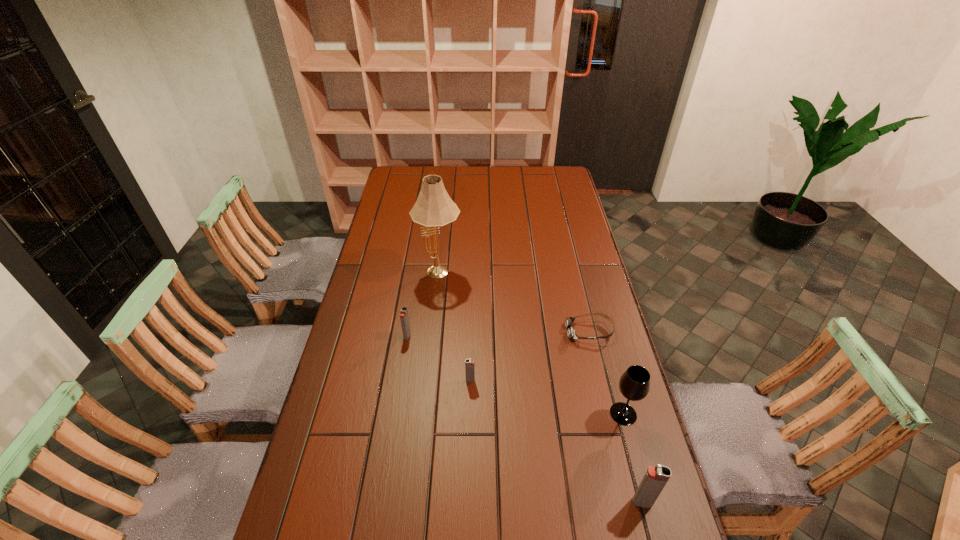
Find the location of a particular element. The height and width of the screenshot is (540, 960). free space located 0.120m on the right of the farthest igniter is located at coordinates (446, 336).

Image resolution: width=960 pixels, height=540 pixels. Identify the location of free space located on the right of the second farthest igniter. (537, 381).

I want to click on free space located on the back of the nearest igniter, so click(x=607, y=366).

This screenshot has width=960, height=540. What are the coordinates of `free space located 0.290m on the front of the farthest object` in the screenshot? It's located at (432, 350).

This screenshot has width=960, height=540. Find the location of `vacant space located 0.350m on the front-facing side of the goggles`. vacant space located 0.350m on the front-facing side of the goggles is located at coordinates 465,332.

Find the location of `free space located on the front-facing side of the goggles`. free space located on the front-facing side of the goggles is located at coordinates (493, 332).

Locate an element on the screen. The width and height of the screenshot is (960, 540). vacant space located 0.350m on the front-facing side of the goggles is located at coordinates (465, 332).

Where is `vacant space located 0.190m on the left of the wineglass`? vacant space located 0.190m on the left of the wineglass is located at coordinates (544, 414).

Find the location of a particular element. object that is at the near edge is located at coordinates 655,478.

Where is `igniter located in the right edge section of the desktop`? igniter located in the right edge section of the desktop is located at coordinates (655, 478).